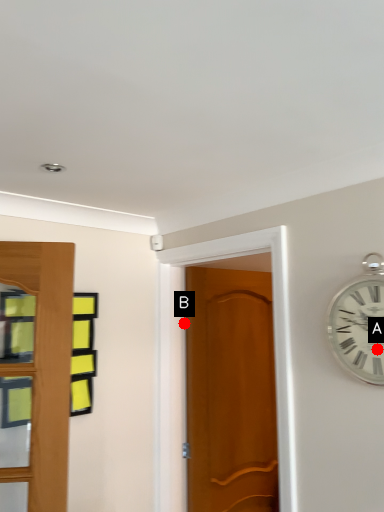
Question: Two points are circled on the image, labeled by A and B beside each circle. Which point is closer to the camera taking this photo?

Choices:
 (A) A is closer
 (B) B is closer

Answer: (A)